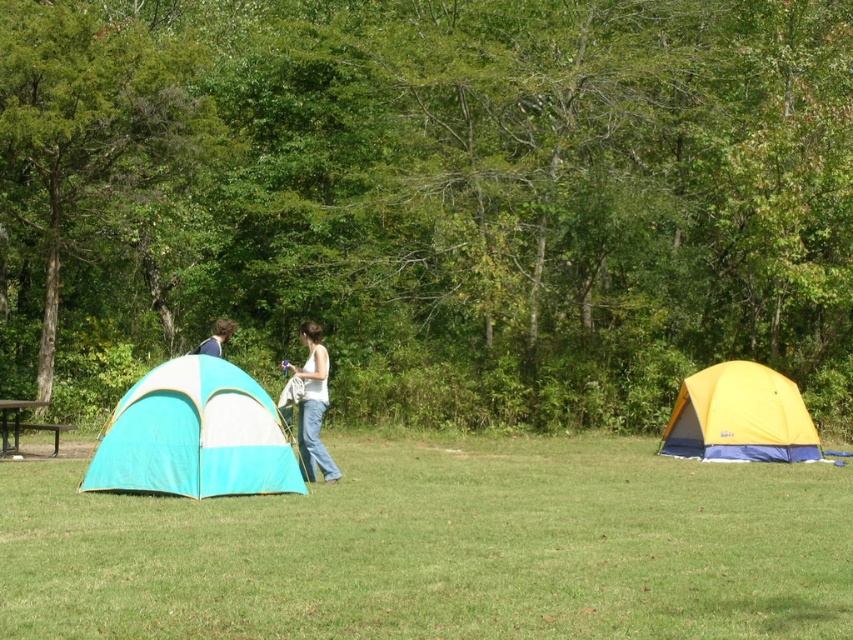
Is brushed metal picnic table at left above matte blue shirt at left?

No.

Which of these two, brushed metal picnic table at left or matte blue shirt at left, stands shorter?

brushed metal picnic table at left is shorter.

Describe the element at coordinates (24, 424) in the screenshot. I see `brushed metal picnic table at left` at that location.

Identify the location of brushed metal picnic table at left. The width and height of the screenshot is (853, 640). (24, 424).

Between teal fabric tent at left and yellow fabric tent at right, which one is positioned lower?

yellow fabric tent at right is lower down.

What do you see at coordinates (194, 435) in the screenshot? The height and width of the screenshot is (640, 853). I see `teal fabric tent at left` at bounding box center [194, 435].

Find the location of a particular element. teal fabric tent at left is located at coordinates tap(194, 435).

Can you confirm if white cotton tank top at center is thinner than brushed metal picnic table at left?

Yes.

Is white cotton tank top at center to the left of brushed metal picnic table at left from the viewer's perspective?

No, white cotton tank top at center is not to the left of brushed metal picnic table at left.

Locate an element on the screen. The width and height of the screenshot is (853, 640). white cotton tank top at center is located at coordinates (312, 404).